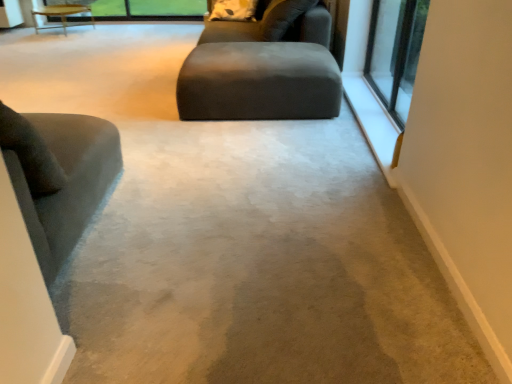
Question: Considering the positions of matte gray ottoman at center and clear glass window at upper right in the image, is matte gray ottoman at center bigger or smaller than clear glass window at upper right?

Choices:
 (A) big
 (B) small

Answer: (A)

Question: Is matte gray ottoman at center wider or thinner than clear glass window at upper right?

Choices:
 (A) thin
 (B) wide

Answer: (B)

Question: Based on their relative distances, which object is farther from the white soft pillow at upper center?

Choices:
 (A) clear glass window at upper right
 (B) matte gray ottoman at center
 (C) wooden table at upper left
 (D) velvet gray chair at left

Answer: (C)

Question: Which object is positioned closest to the matte gray ottoman at center?

Choices:
 (A) wooden table at upper left
 (B) white soft pillow at upper center
 (C) velvet gray chair at left
 (D) clear glass window at upper right

Answer: (D)